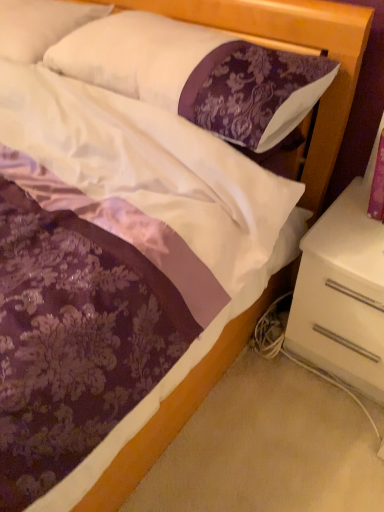
Question: From the image's perspective, does purple damask pillow at upper center, acting as the first pillow starting from the right, appear lower than white soft pillow at upper left, the 1th pillow from the left?

Choices:
 (A) no
 (B) yes

Answer: (B)

Question: Is purple damask pillow at upper center, the 2th pillow when ordered from left to right, to the left of white soft pillow at upper left, the 1th pillow from the left, from the viewer's perspective?

Choices:
 (A) no
 (B) yes

Answer: (A)

Question: Is purple damask pillow at upper center, acting as the first pillow starting from the right, turned away from white soft pillow at upper left, the 1th pillow from the left?

Choices:
 (A) yes
 (B) no

Answer: (B)

Question: Considering the relative sizes of purple damask pillow at upper center, the 2th pillow when ordered from left to right, and white soft pillow at upper left, the 1th pillow from the left, in the image provided, is purple damask pillow at upper center, the 2th pillow when ordered from left to right, wider than white soft pillow at upper left, the 1th pillow from the left,?

Choices:
 (A) no
 (B) yes

Answer: (A)

Question: Can you confirm if purple damask pillow at upper center, the 2th pillow when ordered from left to right, is bigger than white soft pillow at upper left, the 1th pillow from the left?

Choices:
 (A) yes
 (B) no

Answer: (B)

Question: Is purple damask pillow at upper center, the 2th pillow when ordered from left to right, touching white soft pillow at upper left, the second pillow positioned from the right?

Choices:
 (A) yes
 (B) no

Answer: (B)

Question: Is white soft pillow at upper left, the 1th pillow from the left, shorter than purple damask pillow at upper center, the 2th pillow when ordered from left to right?

Choices:
 (A) yes
 (B) no

Answer: (B)

Question: Is white soft pillow at upper left, the 1th pillow from the left, closer to the viewer compared to purple damask pillow at upper center, acting as the first pillow starting from the right?

Choices:
 (A) yes
 (B) no

Answer: (B)

Question: Is white soft pillow at upper left, the second pillow positioned from the right, positioned beyond the bounds of purple damask pillow at upper center, the 2th pillow when ordered from left to right?

Choices:
 (A) no
 (B) yes

Answer: (B)

Question: From the image's perspective, would you say white soft pillow at upper left, the 1th pillow from the left, is positioned over purple damask pillow at upper center, acting as the first pillow starting from the right?

Choices:
 (A) no
 (B) yes

Answer: (B)

Question: Does white soft pillow at upper left, the second pillow positioned from the right, lie behind purple damask pillow at upper center, the 2th pillow when ordered from left to right?

Choices:
 (A) yes
 (B) no

Answer: (A)

Question: Considering the relative sizes of white soft pillow at upper left, the second pillow positioned from the right, and purple damask pillow at upper center, acting as the first pillow starting from the right, in the image provided, is white soft pillow at upper left, the second pillow positioned from the right, taller than purple damask pillow at upper center, acting as the first pillow starting from the right,?

Choices:
 (A) yes
 (B) no

Answer: (A)

Question: From the image's perspective, is white glossy nightstand at lower right on white soft pillow at upper left, the 1th pillow from the left?

Choices:
 (A) yes
 (B) no

Answer: (B)